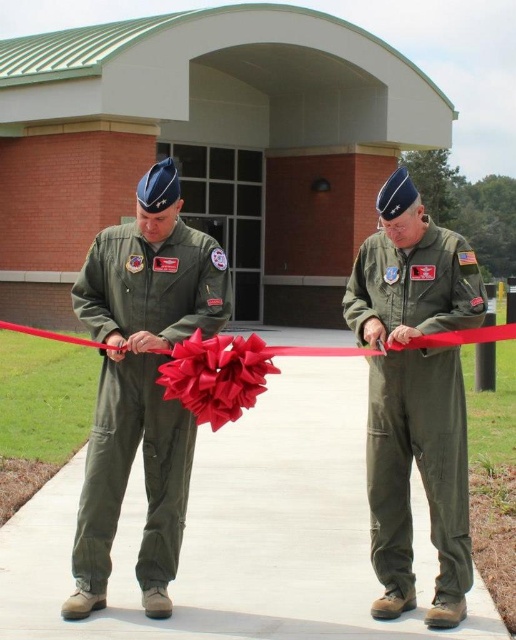
Can you confirm if green matte uniform at center is positioned above red satin ribbon at center?

No, green matte uniform at center is not above red satin ribbon at center.

Identify the location of green matte uniform at center. This screenshot has height=640, width=516. (129, 472).

Locate an element on the screen. green matte uniform at center is located at coordinates (129, 472).

Image resolution: width=516 pixels, height=640 pixels. I want to click on green fabric uniform at center, so click(x=417, y=465).

Who is more forward, (441,451) or (508,337)?

Point (508,337) is in front.

Identify the location of green fabric uniform at center. The width and height of the screenshot is (516, 640). (417, 465).

Identify the location of green fabric uniform at center. (417, 465).

Does green matte uniform at center have a lesser height compared to green fabric uniform at center?

Yes.

Is green matte uniform at center taller than green fabric uniform at center?

Incorrect, green matte uniform at center's height is not larger of green fabric uniform at center's.

At what (x,y) coordinates should I click in order to perform the action: click on green matte uniform at center. Please return your answer as a coordinate pair (x, y). The height and width of the screenshot is (640, 516). Looking at the image, I should click on (129, 472).

At what (x,y) coordinates should I click in order to perform the action: click on green matte uniform at center. Please return your answer as a coordinate pair (x, y). The height and width of the screenshot is (640, 516). Looking at the image, I should click on (129, 472).